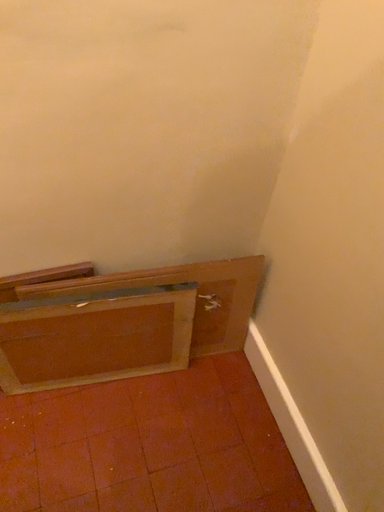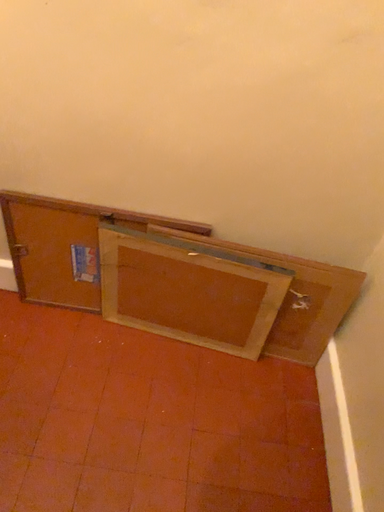
Question: Which way did the camera rotate in the video?

Choices:
 (A) rotated downward
 (B) rotated upward

Answer: (B)